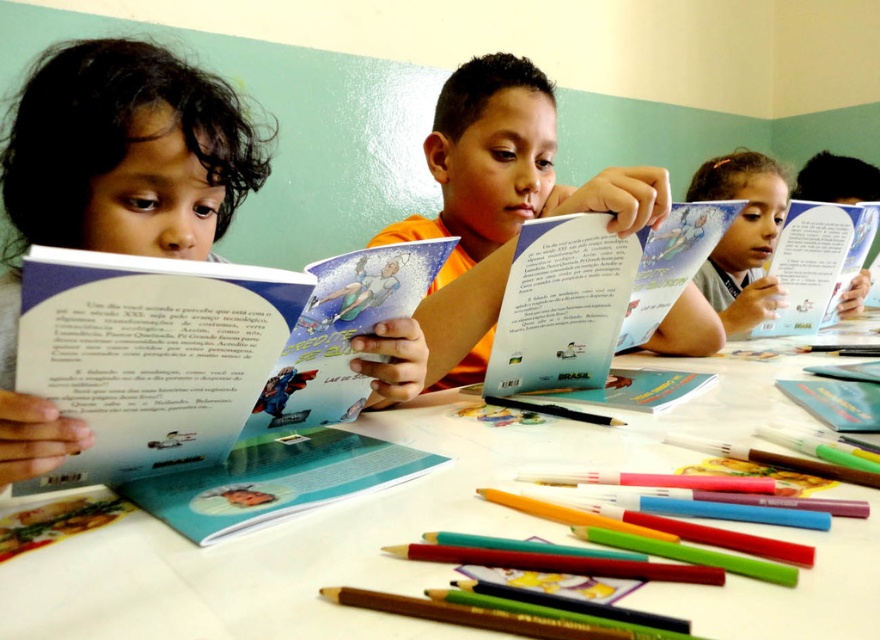
Question: Does matte paper book at center appear on the right side of hardcover book at upper right?

Choices:
 (A) yes
 (B) no

Answer: (B)

Question: Estimate the real-world distances between objects in this image. Which object is closer to the orange matte book at center?

Choices:
 (A) white paper table at center
 (B) matte paper book at upper right
 (C) matte paper book at center
 (D) matte blue book at upper right

Answer: (B)

Question: Is orange matte book at center thinner than matte blue book at upper right?

Choices:
 (A) yes
 (B) no

Answer: (A)

Question: Can you confirm if white paper table at center is positioned above matte paper book at upper right?

Choices:
 (A) yes
 (B) no

Answer: (B)

Question: Which object appears farthest from the camera in this image?

Choices:
 (A) orange matte book at center
 (B) matte paper book at upper right
 (C) white paper table at center
 (D) matte paper book at center

Answer: (B)

Question: Which point is farther from the camera taking this photo?

Choices:
 (A) (152, 323)
 (B) (671, 288)

Answer: (B)